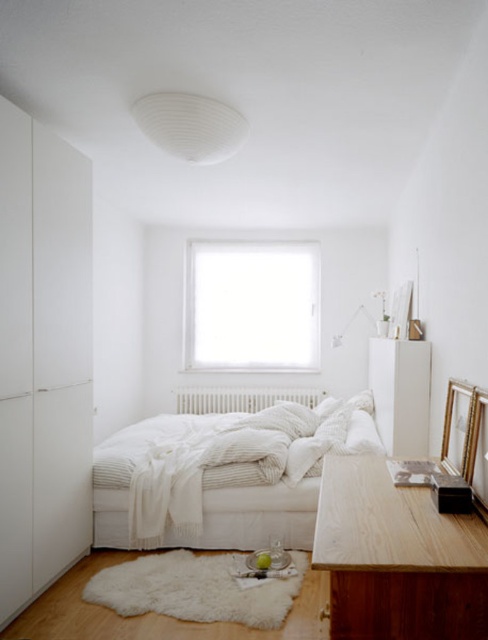
Can you confirm if white soft bed at center is positioned below white matte radiator at center?

Correct, white soft bed at center is located below white matte radiator at center.

Which is behind, point (278, 467) or point (211, 400)?

The point (211, 400) is behind.

What do you see at coordinates (273, 484) in the screenshot? This screenshot has width=488, height=640. I see `white soft bed at center` at bounding box center [273, 484].

Locate an element on the screen. white soft bed at center is located at coordinates click(x=273, y=484).

Is point (203, 291) behind point (176, 408)?

That is True.

Does transparent glass window at center have a lesser width compared to white matte radiator at center?

Correct, transparent glass window at center's width is less than white matte radiator at center's.

Looking at this image, who is more distant from viewer, (203, 300) or (189, 388)?

The point (203, 300) is behind.

Identify the location of transparent glass window at center. Image resolution: width=488 pixels, height=640 pixels. (251, 305).

Does white matte wardrobe at left have a lesser width compared to white soft bed at center?

Indeed, white matte wardrobe at left has a lesser width compared to white soft bed at center.

Is white matte wardrobe at left positioned before white soft bed at center?

That is True.

At what (x,y) coordinates should I click in order to perform the action: click on white matte wardrobe at left. Please return your answer as a coordinate pair (x, y). Image resolution: width=488 pixels, height=640 pixels. Looking at the image, I should click on (42, 356).